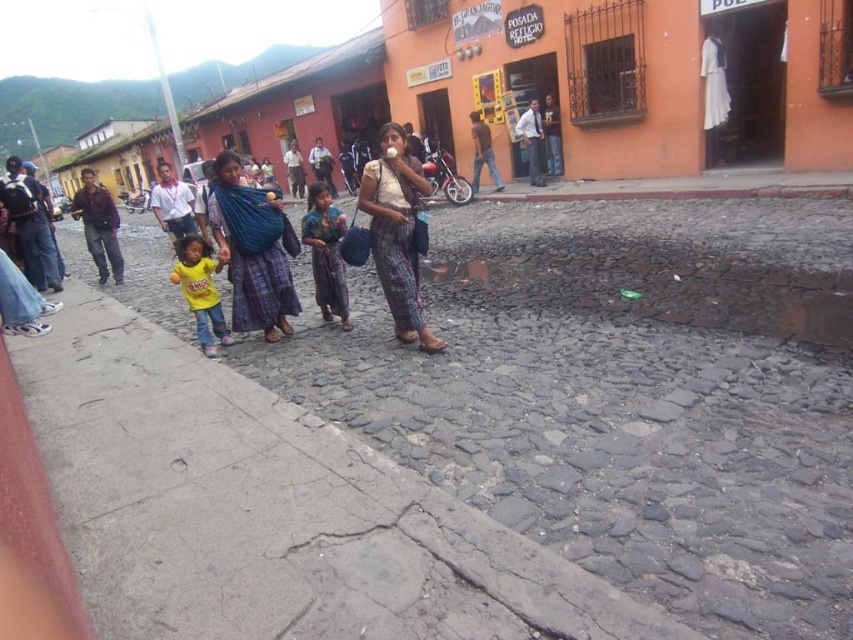
Who is positioned more to the right, gray cobblestone pavement at center or printed fabric dress at center?

gray cobblestone pavement at center

Consider the image. Does gray cobblestone pavement at center have a lesser width compared to printed fabric dress at center?

In fact, gray cobblestone pavement at center might be wider than printed fabric dress at center.

In order to click on gray cobblestone pavement at center in this screenshot , I will do `click(438, 472)`.

Image resolution: width=853 pixels, height=640 pixels. What are the coordinates of `gray cobblestone pavement at center` in the screenshot? It's located at (438, 472).

Is point (241, 214) farther from camera compared to point (335, 285)?

That is False.

Does blue woven fabric at center appear over printed fabric dress at center?

Actually, blue woven fabric at center is below printed fabric dress at center.

Is point (286, 323) in front of point (346, 316)?

That is True.

At what (x,y) coordinates should I click in order to perform the action: click on blue woven fabric at center. Please return your answer as a coordinate pair (x, y). Looking at the image, I should click on (251, 252).

Does white cotton blouse at center have a smaller size compared to printed fabric dress at center?

No.

Is point (409, 296) farther from camera compared to point (347, 310)?

No, it is in front of (347, 310).

Image resolution: width=853 pixels, height=640 pixels. I want to click on white cotton blouse at center, so click(397, 234).

At what (x,y) coordinates should I click in order to perform the action: click on white cotton blouse at center. Please return your answer as a coordinate pair (x, y). The height and width of the screenshot is (640, 853). Looking at the image, I should click on (397, 234).